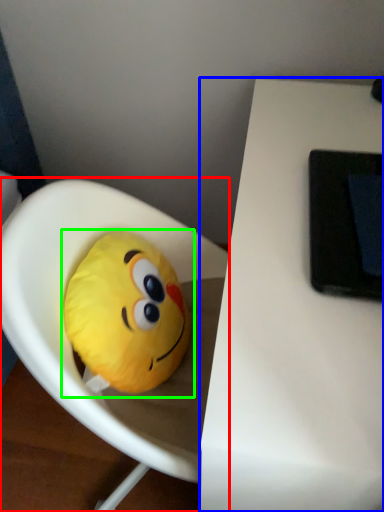
Question: Which is nearer to the toy (highlighted by a red box)? table (highlighted by a blue box) or toy (highlighted by a green box).

Choices:
 (A) table
 (B) toy

Answer: (B)